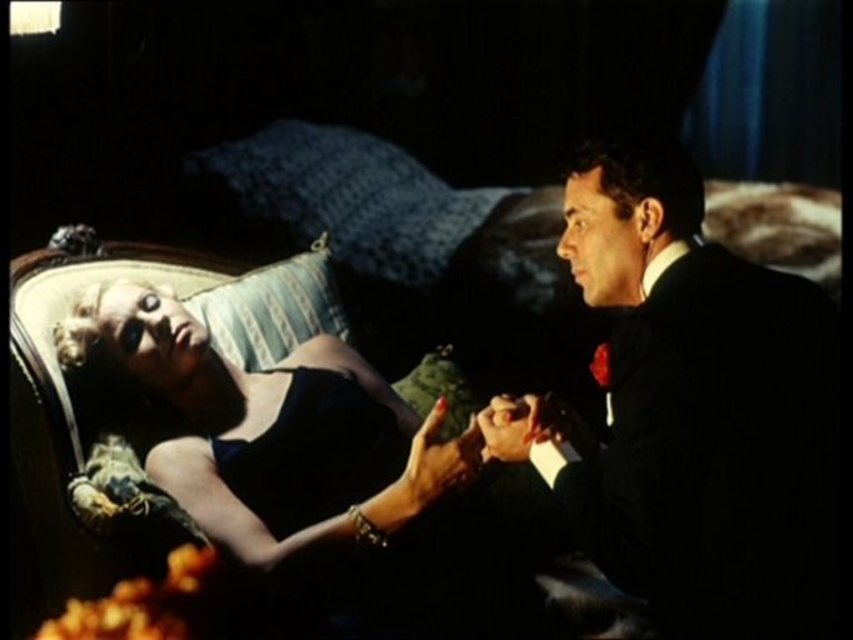
You are a costume designer working on a film scene. You need to ensure that the shiny black suit at right and the matte black dress at center are visible to the audience. Given their sizes, which one might you consider moving closer to the camera to ensure visibility?

The shiny black suit at right is smaller than the matte black dress at center, so moving the shiny black suit at right closer to the camera would help ensure its visibility.